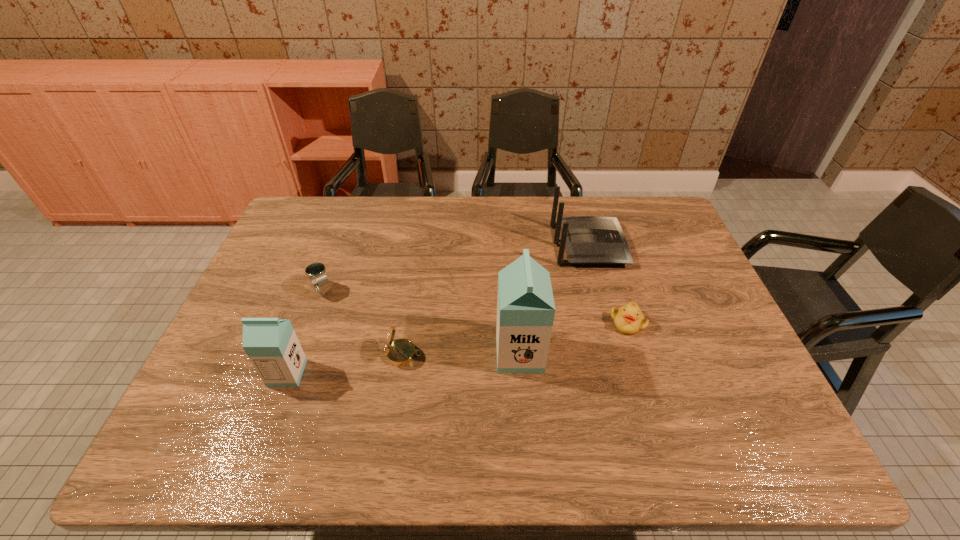
In the image, there is a desktop. Where is `vacant space at the near edge`? Image resolution: width=960 pixels, height=540 pixels. vacant space at the near edge is located at coordinates (604, 413).

Identify the location of free spot at the left edge of the desktop. This screenshot has width=960, height=540. (270, 262).

The height and width of the screenshot is (540, 960). Identify the location of vacant space at the right edge of the desktop. (667, 276).

In order to click on vacant space at the far right corner in this screenshot , I will do `click(652, 212)`.

The image size is (960, 540). Find the location of `free region at the near right corner of the desktop`. free region at the near right corner of the desktop is located at coordinates (757, 408).

Locate an element on the screen. The width and height of the screenshot is (960, 540). free area in between the left milk carton and the farthest object is located at coordinates (438, 309).

Image resolution: width=960 pixels, height=540 pixels. Identify the location of empty location between the third object from left to right and the tallest object. tap(461, 354).

Where is `free area in between the router and the duckling`? Image resolution: width=960 pixels, height=540 pixels. free area in between the router and the duckling is located at coordinates [x=608, y=284].

Where is `vacant space that's between the watch and the compass`? Image resolution: width=960 pixels, height=540 pixels. vacant space that's between the watch and the compass is located at coordinates (363, 322).

You are a GUI agent. You are given a task and a screenshot of the screen. Output one action in this format:
    pyautogui.click(x=<x>, y=<y>)
    Task: Click on the free space between the right milk carton and the fifth nearest object
    The image size is (960, 540).
    Given the screenshot: What is the action you would take?
    [x=421, y=322]